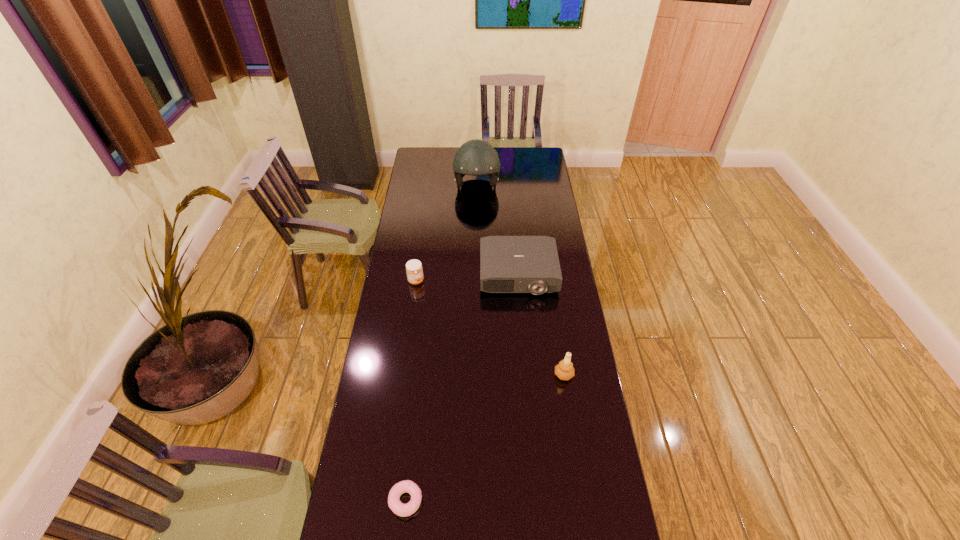
The image size is (960, 540). Identify the location of the farthest object. (476, 157).

Identify the location of the tallest object. This screenshot has height=540, width=960. (476, 157).

You are a GUI agent. You are given a task and a screenshot of the screen. Output one action in this format:
    pyautogui.click(x=<x>, y=<y>)
    Task: Click on the second nearest object
    
    Given the screenshot: What is the action you would take?
    tap(564, 370)

Find the location of `candle_holder`. candle_holder is located at coordinates (564, 370).

Find the location of a particular element. projector is located at coordinates (508, 264).

You are a GUI agent. You are given a task and a screenshot of the screen. Output one action in this format:
    pyautogui.click(x=<x>, y=<y>)
    Task: Click on the jam
    
    Given the screenshot: What is the action you would take?
    pyautogui.click(x=414, y=269)

The height and width of the screenshot is (540, 960). Identify the location of doughnut. (406, 486).

The height and width of the screenshot is (540, 960). I want to click on the shortest object, so click(406, 486).

Where is `vacant space positioned at the face opening of the football helmet`? vacant space positioned at the face opening of the football helmet is located at coordinates (476, 222).

At what (x,y) coordinates should I click in order to perform the action: click on free point located 0.330m on the back of the fourth shortest object. Please return your answer as a coordinate pair (x, y). This screenshot has width=960, height=540. Looking at the image, I should click on (552, 299).